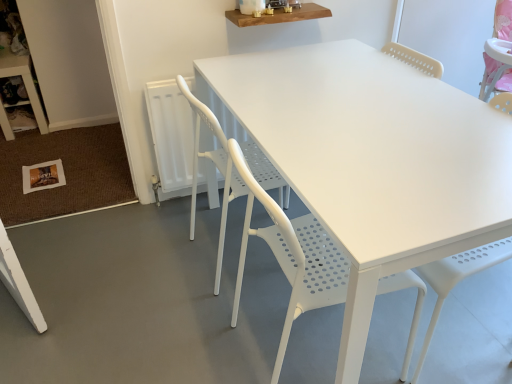
Locate an element on the screen. The width and height of the screenshot is (512, 384). free space in front of white perforated plastic chair at center, marked as the second chair in a front-to-back arrangement is located at coordinates (211, 323).